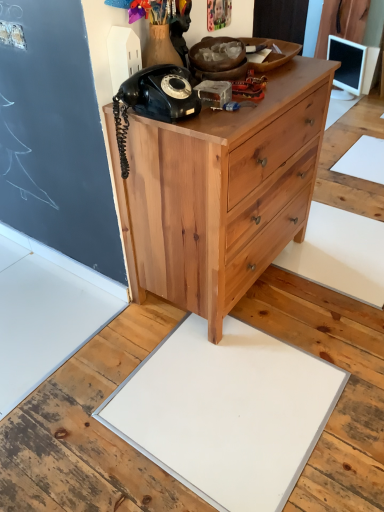
Question: Is black matte rotary phone at upper left shorter than white glossy monitor at upper right?

Choices:
 (A) yes
 (B) no

Answer: (A)

Question: From a real-world perspective, does black matte rotary phone at upper left sit lower than white glossy monitor at upper right?

Choices:
 (A) yes
 (B) no

Answer: (B)

Question: Is black matte rotary phone at upper left positioned beyond the bounds of white glossy monitor at upper right?

Choices:
 (A) no
 (B) yes

Answer: (B)

Question: Is black matte rotary phone at upper left next to white glossy monitor at upper right?

Choices:
 (A) yes
 (B) no

Answer: (B)

Question: Is black matte rotary phone at upper left turned away from white glossy monitor at upper right?

Choices:
 (A) yes
 (B) no

Answer: (B)

Question: From a real-world perspective, is white matte slate at center above or below black matte rotary phone at upper left?

Choices:
 (A) above
 (B) below

Answer: (B)

Question: From the image's perspective, is white matte slate at center located above or below black matte rotary phone at upper left?

Choices:
 (A) below
 (B) above

Answer: (A)

Question: Based on their positions, is white matte slate at center located to the left or right of black matte rotary phone at upper left?

Choices:
 (A) right
 (B) left

Answer: (A)

Question: Does point (129, 437) appear closer or farther from the camera than point (127, 173)?

Choices:
 (A) closer
 (B) farther

Answer: (A)

Question: Is natural wood chest of drawers at center taller or shorter than white matte slate at center?

Choices:
 (A) short
 (B) tall

Answer: (B)

Question: Is natural wood chest of drawers at center in front of or behind white matte slate at center in the image?

Choices:
 (A) behind
 (B) front

Answer: (A)

Question: Do you think natural wood chest of drawers at center is within white matte slate at center, or outside of it?

Choices:
 (A) inside
 (B) outside

Answer: (B)

Question: From the image's perspective, is natural wood chest of drawers at center located above or below white matte slate at center?

Choices:
 (A) above
 (B) below

Answer: (A)

Question: From the image's perspective, is white matte slate at center located above or below natural wood chest of drawers at center?

Choices:
 (A) above
 (B) below

Answer: (B)

Question: From a real-world perspective, is white matte slate at center physically located above or below natural wood chest of drawers at center?

Choices:
 (A) below
 (B) above

Answer: (A)